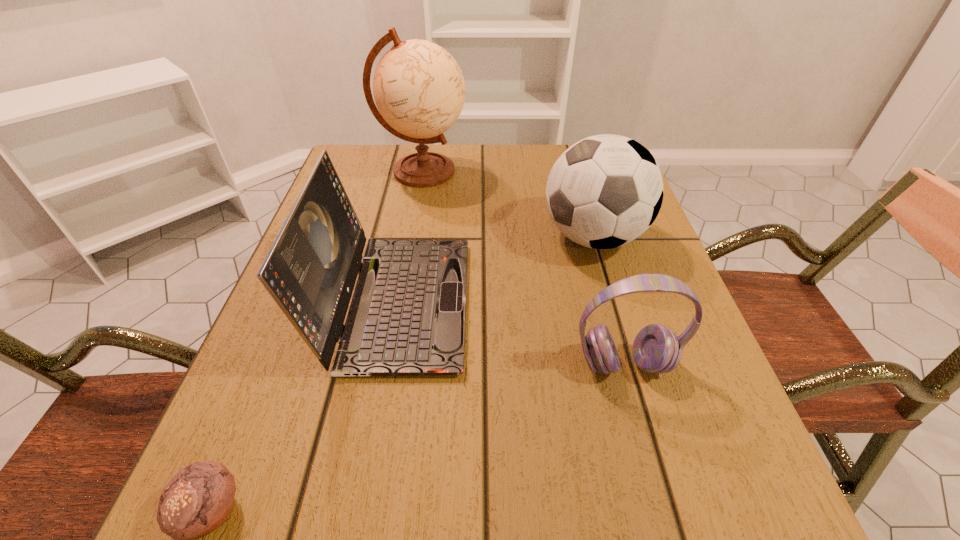
At what (x,y) coordinates should I click in order to perform the action: click on vacant space located 0.180m on the headband and ear cups of the headset. Please return your answer as a coordinate pair (x, y). This screenshot has height=540, width=960. Looking at the image, I should click on [x=665, y=509].

This screenshot has width=960, height=540. What are the coordinates of `object at the far edge` in the screenshot? It's located at (419, 89).

The width and height of the screenshot is (960, 540). I want to click on globe situated at the left edge, so click(x=419, y=89).

Locate an element on the screen. laptop computer located in the left edge section of the desktop is located at coordinates (407, 316).

Identify the location of soccer ball that is at the right edge. The image size is (960, 540). (604, 191).

Locate an element on the screen. The width and height of the screenshot is (960, 540). headset present at the right edge is located at coordinates (656, 349).

The image size is (960, 540). What are the coordinates of `object located at the far left corner` in the screenshot? It's located at (419, 89).

I want to click on vacant space at the far edge, so click(x=501, y=156).

The width and height of the screenshot is (960, 540). In the image, there is a desktop. Identify the location of vacant space at the near edge. (528, 502).

Locate an element on the screen. This screenshot has height=540, width=960. vacant space at the left edge of the desktop is located at coordinates (281, 401).